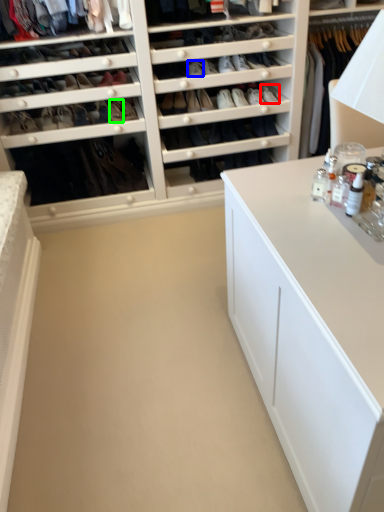
Question: Which is nearer to the shoe (highlighted by a red box)? shoe (highlighted by a blue box) or shoe (highlighted by a green box).

Choices:
 (A) shoe
 (B) shoe

Answer: (A)